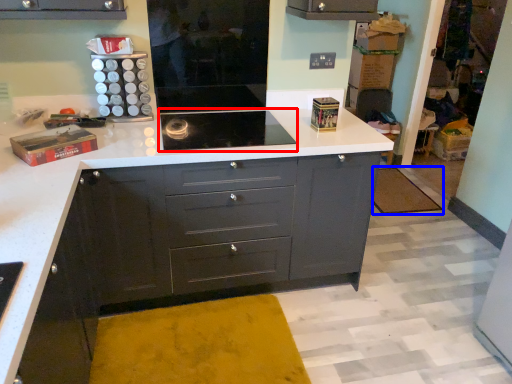
Question: Among these objects, which one is nearest to the camera, home appliance (highlighted by a red box) or mat (highlighted by a blue box)?

Choices:
 (A) home appliance
 (B) mat

Answer: (A)